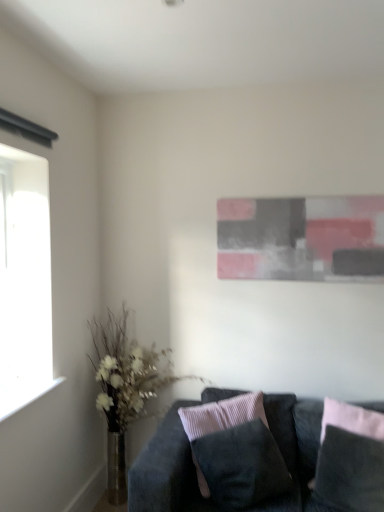
Question: From the image's perspective, is translucent glass vase at left located above velvet dark gray pillow at lower right, which ranks as the 2th pillow in left-to-right order?

Choices:
 (A) no
 (B) yes

Answer: (B)

Question: Is translucent glass vase at left thinner than velvet dark gray pillow at lower right, which appears as the 1th pillow when viewed from the right?

Choices:
 (A) yes
 (B) no

Answer: (B)

Question: From the image's perspective, would you say translucent glass vase at left is shown under velvet dark gray pillow at lower right, which appears as the 1th pillow when viewed from the right?

Choices:
 (A) no
 (B) yes

Answer: (A)

Question: Is translucent glass vase at left not close to velvet dark gray pillow at lower right, which ranks as the 2th pillow in left-to-right order?

Choices:
 (A) yes
 (B) no

Answer: (A)

Question: Is translucent glass vase at left positioned behind velvet dark gray pillow at lower right, which appears as the 1th pillow when viewed from the right?

Choices:
 (A) yes
 (B) no

Answer: (A)

Question: Is the surface of translucent glass vase at left in direct contact with velvet dark gray pillow at lower right, which ranks as the 2th pillow in left-to-right order?

Choices:
 (A) no
 (B) yes

Answer: (A)

Question: From the image's perspective, is transparent glass window at left over suede-like black pillow at center, the 2th pillow from the right?

Choices:
 (A) no
 (B) yes

Answer: (B)

Question: Can you confirm if transparent glass window at left is shorter than suede-like black pillow at center, which is the 1th pillow from left to right?

Choices:
 (A) no
 (B) yes

Answer: (A)

Question: From a real-world perspective, is transparent glass window at left on top of suede-like black pillow at center, which is the 1th pillow from left to right?

Choices:
 (A) yes
 (B) no

Answer: (A)

Question: Is transparent glass window at left beside suede-like black pillow at center, which is the 1th pillow from left to right?

Choices:
 (A) no
 (B) yes

Answer: (A)

Question: Is suede-like black pillow at center, the 2th pillow from the right, a part of transparent glass window at left?

Choices:
 (A) yes
 (B) no

Answer: (B)

Question: Is transparent glass window at left completely or partially outside of suede-like black pillow at center, the 2th pillow from the right?

Choices:
 (A) yes
 (B) no

Answer: (A)

Question: Does abstract painting at upper center lie in front of suede-like black pillow at center, the 2th pillow from the right?

Choices:
 (A) yes
 (B) no

Answer: (B)